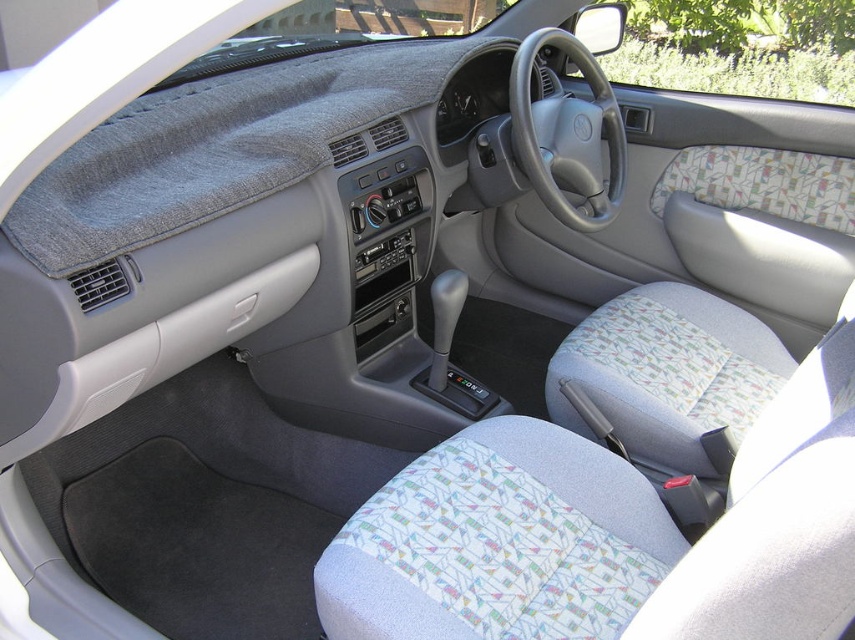
Question: Which point appears closest to the camera in this image?

Choices:
 (A) (282, 113)
 (B) (609, 465)

Answer: (B)

Question: Can you confirm if textured fabric seat at center is wider than gray fabric dashboard cover at upper center?

Choices:
 (A) yes
 (B) no

Answer: (A)

Question: Can you confirm if textured fabric seat at center is positioned to the right of gray fabric dashboard cover at upper center?

Choices:
 (A) no
 (B) yes

Answer: (B)

Question: Can you confirm if textured fabric seat at center is smaller than gray fabric dashboard cover at upper center?

Choices:
 (A) no
 (B) yes

Answer: (A)

Question: Which object appears closest to the camera in this image?

Choices:
 (A) gray fabric dashboard cover at upper center
 (B) textured fabric seat at center

Answer: (B)

Question: Which of the following is the farthest from the observer?

Choices:
 (A) gray fabric dashboard cover at upper center
 (B) textured fabric seat at center

Answer: (A)